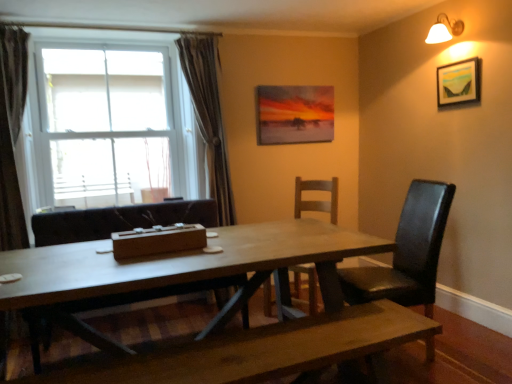
Question: Based on their sizes in the image, would you say wooden table at center is bigger or smaller than matte canvas painting at upper center, placed as the second picture frame when sorted from front to back?

Choices:
 (A) small
 (B) big

Answer: (B)

Question: Is point (318, 264) positioned closer to the camera than point (310, 135)?

Choices:
 (A) closer
 (B) farther

Answer: (A)

Question: Which is nearer to the white ceramic wall lamp at upper right?

Choices:
 (A) wooden table at center
 (B) wooden chair at center, which is the 2th chair in right-to-left order
 (C) brown fabric curtain at left, positioned as the first curtain in front-to-back order
 (D) wooden picture frame at upper right, which ranks as the first picture frame in front-to-back order
 (E) black leather chair at right, placed as the 1th chair when sorted from right to left

Answer: (D)

Question: Which object is the farthest from the white glass window at upper left?

Choices:
 (A) wooden picture frame at upper right, which is the 1th picture frame from right to left
 (B) black leather chair at right, placed as the 1th chair when sorted from right to left
 (C) wooden chair at center, the second chair positioned from the left
 (D) white ceramic wall lamp at upper right
 (E) brown fabric curtain at left, arranged as the second curtain when viewed from the right

Answer: (D)